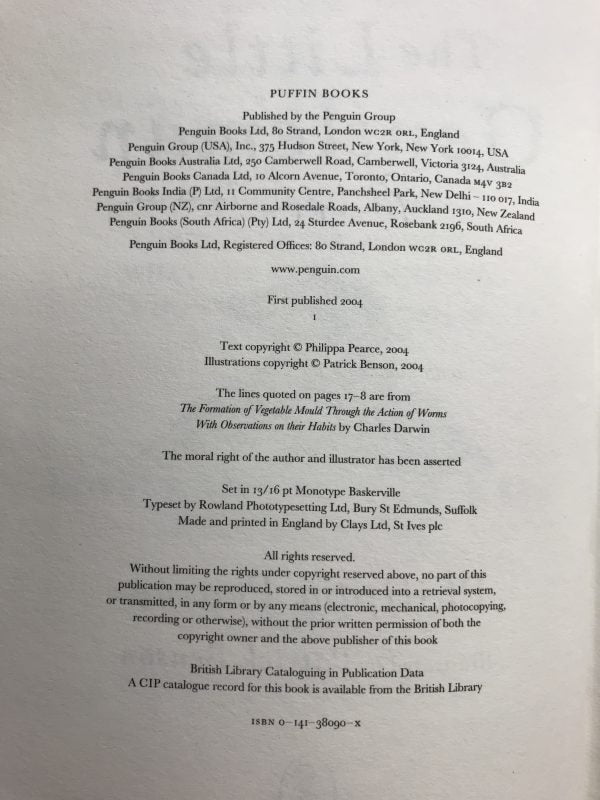
The image size is (600, 800). In order to click on book on page in this screenshot , I will do `click(538, 349)`.